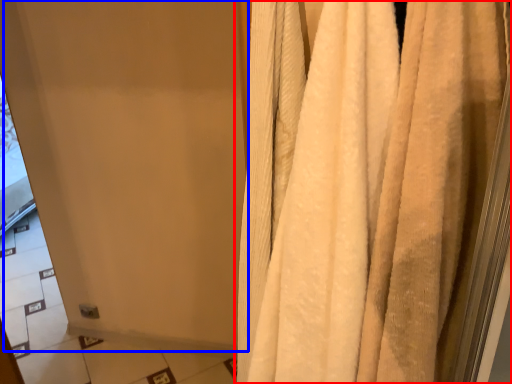
Question: Which object appears closest to the camera in this image, curtain (highlighted by a red box) or screen door (highlighted by a blue box)?

Choices:
 (A) curtain
 (B) screen door

Answer: (A)